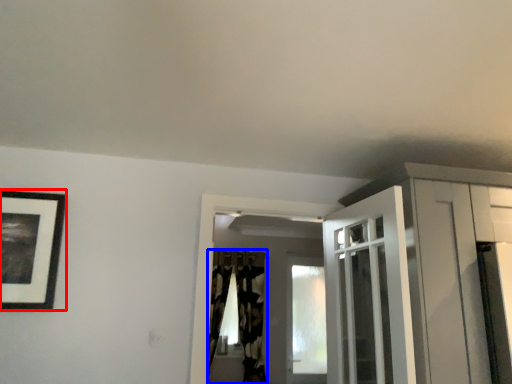
Question: Which object appears farthest to the camera in this image, picture frame (highlighted by a red box) or curtain (highlighted by a blue box)?

Choices:
 (A) picture frame
 (B) curtain

Answer: (B)